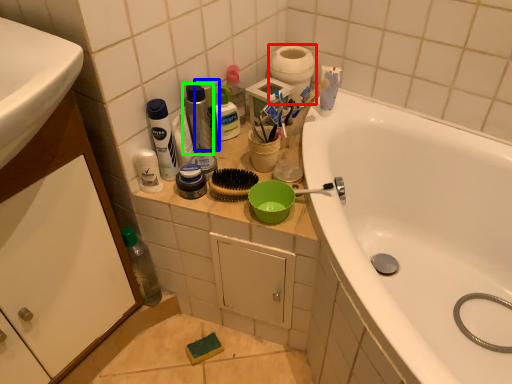
Question: Which object is positioned closest to toilet paper (highlighted by a red box)? Select from personal care (highlighted by a blue box) and cleaning product (highlighted by a green box).

Choices:
 (A) personal care
 (B) cleaning product

Answer: (A)